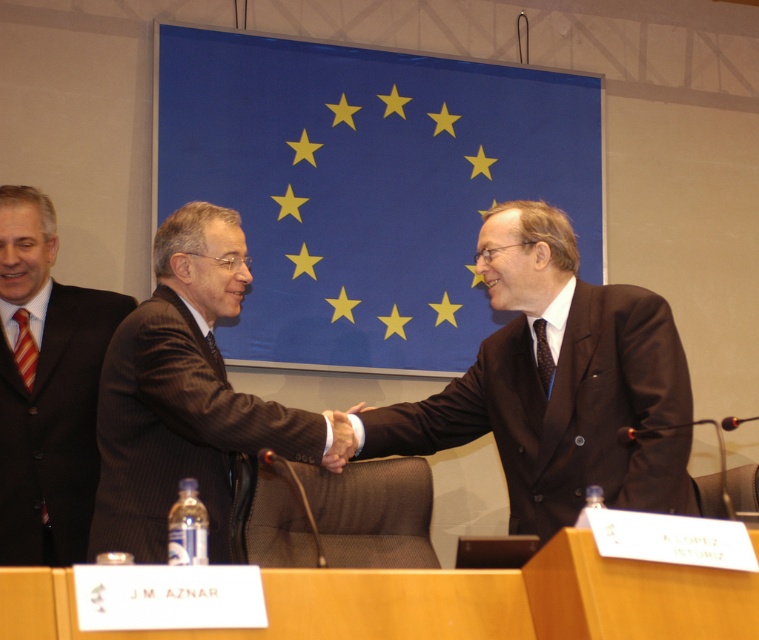
Image resolution: width=759 pixels, height=640 pixels. What do you see at coordinates (559, 387) in the screenshot?
I see `dark brown suit at center` at bounding box center [559, 387].

Measure the distance between point [537,419] and camera.

Point [537,419] and camera are 4.41 meters apart.

Which is in front, point (594, 435) or point (36, 406)?

Positioned in front is point (594, 435).

At what (x,y) coordinates should I click in order to perform the action: click on dark brown suit at center. Please return your answer as a coordinate pair (x, y). The image size is (759, 640). Looking at the image, I should click on (559, 387).

Who is higher up, dark brown suit at center or brown pinstripe suit at center?

dark brown suit at center is above.

Can you confirm if dark brown suit at center is smaller than brown pinstripe suit at center?

No, dark brown suit at center is not smaller than brown pinstripe suit at center.

Who is more distant from viewer, (x=515, y=307) or (x=131, y=340)?

The point (x=515, y=307) is more distant.

The width and height of the screenshot is (759, 640). Find the location of `dark brown suit at center`. dark brown suit at center is located at coordinates (559, 387).

Consider the image. Is brown pinstripe suit at center to the right of matte black suit at left from the viewer's perspective?

Yes, brown pinstripe suit at center is to the right of matte black suit at left.

Can you confirm if brown pinstripe suit at center is smaller than matte black suit at left?

No, brown pinstripe suit at center is not smaller than matte black suit at left.

Locate an element on the screen. brown pinstripe suit at center is located at coordinates (187, 396).